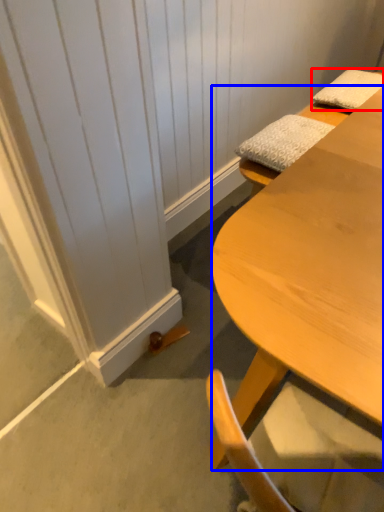
Question: Which point is further to the camera, pillow (highlighted by a red box) or desk (highlighted by a blue box)?

Choices:
 (A) pillow
 (B) desk

Answer: (A)